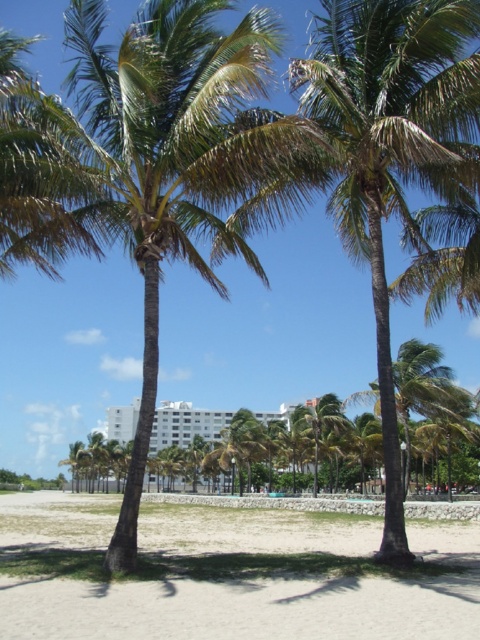
Does green leafy palm tree at center have a greater width compared to white smooth building at center?

No, green leafy palm tree at center is not wider than white smooth building at center.

Between point (196, 198) and point (120, 410), which one is positioned behind?

Positioned behind is point (120, 410).

The image size is (480, 640). Identify the location of green leafy palm tree at center. (155, 163).

In the scene shown: Is green leafy palm tree at center shorter than beige sandy beach at center?

No, green leafy palm tree at center is not shorter than beige sandy beach at center.

In the scene shown: Measure the distance between green leafy palm tree at center and camera.

A distance of 28.83 feet exists between green leafy palm tree at center and camera.

Is point (15, 221) less distant than point (184, 584)?

No, (15, 221) is further to viewer.

Locate an element on the screen. green leafy palm tree at center is located at coordinates (155, 163).

Can you confirm if beige sandy beach at center is positioned above white smooth building at center?

Yes.

Can you confirm if beige sandy beach at center is positioned to the left of white smooth building at center?

Yes, beige sandy beach at center is to the left of white smooth building at center.

Between point (249, 576) and point (216, 440), which one is positioned behind?

Point (216, 440)

Locate an element on the screen. This screenshot has width=480, height=640. beige sandy beach at center is located at coordinates point(228,573).